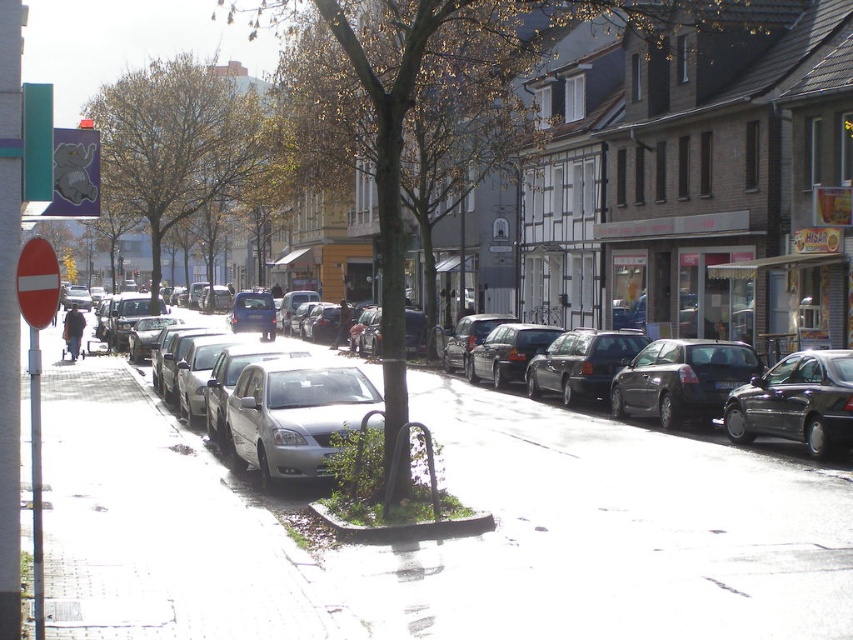
You are a delivery driver with a 2.5 meter wide truck. You need to park your truck in this street where there is space between the shiny dark gray sedan at right and the shiny dark blue sedan at center right. Can you fit your truck between them?

The shiny dark gray sedan at right is narrower than the shiny dark blue sedan at center right. However, the description only provides information about their widths, not the distance between them. Without knowing the actual space between the two sedans, it is impossible to determine if the 2.5 meter wide truck can fit.

You are a delivery person trying to deliver a package to a house on the street. You see the white concrete sidewalk at center and the shiny dark gray sedan at right. Which object is above the other?

The white concrete sidewalk at center is positioned over the shiny dark gray sedan at right, meaning the sidewalk is above the sedan.

You are a pedestrian standing on the sidewalk and want to cross the street to reach a store on the other side. The shiny dark blue sedan at center right and the shiny black sedan at center are parked in your path. Which car should you move around first if you need to get past both?

You should move around the shiny black sedan at center first because the shiny dark blue sedan at center right is positioned to its right, meaning the shiny black sedan is closer to you on the left side of the path.